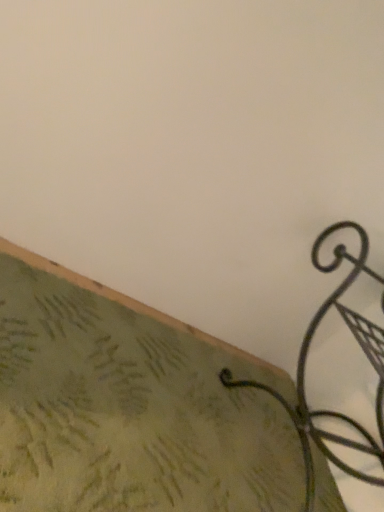
You are a GUI agent. You are given a task and a screenshot of the screen. Output one action in this format:
    pyautogui.click(x=<x>, y=<y>)
    Task: Click on the black wrought iron hook at lower right
    The image size is (384, 512).
    Given the screenshot: What is the action you would take?
    pyautogui.click(x=305, y=362)

What do you see at coordinates (305, 362) in the screenshot? The image size is (384, 512). I see `black wrought iron hook at lower right` at bounding box center [305, 362].

This screenshot has height=512, width=384. What do you see at coordinates (130, 409) in the screenshot?
I see `green textured fabric at lower left` at bounding box center [130, 409].

Based on the photo, measure the distance between point (111, 384) and camera.

They are 1.04 meters apart.

Find the location of a particular element. green textured fabric at lower left is located at coordinates (130, 409).

Locate an element on the screen. The height and width of the screenshot is (512, 384). black wrought iron hook at lower right is located at coordinates (305, 362).

Considering the positions of objects black wrought iron hook at lower right and green textured fabric at lower left in the image provided, who is more to the left, black wrought iron hook at lower right or green textured fabric at lower left?

From the viewer's perspective, green textured fabric at lower left appears more on the left side.

Is the depth of black wrought iron hook at lower right less than that of green textured fabric at lower left?

That is False.

Between point (297, 383) and point (275, 414), which one is positioned behind?

The point (275, 414) is behind.

From the image's perspective, does black wrought iron hook at lower right appear higher than green textured fabric at lower left?

Yes, from the image's perspective, black wrought iron hook at lower right is above green textured fabric at lower left.

From a real-world perspective, does black wrought iron hook at lower right stand above green textured fabric at lower left?

Yes.

Which object is wider, black wrought iron hook at lower right or green textured fabric at lower left?

green textured fabric at lower left.

Which of these two, black wrought iron hook at lower right or green textured fabric at lower left, stands taller?

black wrought iron hook at lower right is taller.

Who is smaller, black wrought iron hook at lower right or green textured fabric at lower left?

green textured fabric at lower left is smaller.

Is black wrought iron hook at lower right inside or outside of green textured fabric at lower left?

black wrought iron hook at lower right lies outside green textured fabric at lower left.

Is black wrought iron hook at lower right placed right next to green textured fabric at lower left?

No, black wrought iron hook at lower right is not in contact with green textured fabric at lower left.

Could you tell me if black wrought iron hook at lower right is turned towards green textured fabric at lower left?

Yes, black wrought iron hook at lower right is oriented towards green textured fabric at lower left.

Measure the distance from black wrought iron hook at lower right to green textured fabric at lower left.

A distance of 11.77 inches exists between black wrought iron hook at lower right and green textured fabric at lower left.

Find the location of a particular element. Image resolution: width=384 pixels, height=512 pixels. surface below the black wrought iron hook at lower right (from the image's perspective) is located at coordinates (130, 409).

From the picture: Which is more to the left, green textured fabric at lower left or black wrought iron hook at lower right?

green textured fabric at lower left.

Is green textured fabric at lower left closer to the viewer compared to black wrought iron hook at lower right?

Yes.

Considering the points (166, 477) and (369, 478), which point is behind, point (166, 477) or point (369, 478)?

The point (369, 478) is farther.

From the image's perspective, relative to black wrought iron hook at lower right, is green textured fabric at lower left above or below?

From the image's perspective, green textured fabric at lower left appears below black wrought iron hook at lower right.

From a real-world perspective, is green textured fabric at lower left on black wrought iron hook at lower right?

Actually, green textured fabric at lower left is physically below black wrought iron hook at lower right in the real world.

Considering the sizes of objects green textured fabric at lower left and black wrought iron hook at lower right in the image provided, who is wider, green textured fabric at lower left or black wrought iron hook at lower right?

green textured fabric at lower left is wider.

Can you confirm if green textured fabric at lower left is taller than black wrought iron hook at lower right?

No, green textured fabric at lower left is not taller than black wrought iron hook at lower right.

Between green textured fabric at lower left and black wrought iron hook at lower right, which one has smaller size?

With smaller size is green textured fabric at lower left.

Could black wrought iron hook at lower right be considered to be inside green textured fabric at lower left?

No, black wrought iron hook at lower right is not inside green textured fabric at lower left.

In the scene shown: Is green textured fabric at lower left directly adjacent to black wrought iron hook at lower right?

They are not placed beside each other.

Is green textured fabric at lower left facing away from black wrought iron hook at lower right?

green textured fabric at lower left does not have its back to black wrought iron hook at lower right.

How many degrees apart are the facing directions of green textured fabric at lower left and black wrought iron hook at lower right?

They differ by 0.745 degrees in their facing directions.

You are a GUI agent. You are given a task and a screenshot of the screen. Output one action in this format:
    pyautogui.click(x=<x>, y=<y>)
    Task: Click on the furniture located behind the green textured fabric at lower left
    
    Given the screenshot: What is the action you would take?
    pyautogui.click(x=305, y=362)

In order to click on surface on the left of black wrought iron hook at lower right in this screenshot , I will do `click(130, 409)`.

The height and width of the screenshot is (512, 384). In the image, there is a black wrought iron hook at lower right. Find the location of `surface below it (from a real-world perspective)`. surface below it (from a real-world perspective) is located at coordinates (130, 409).